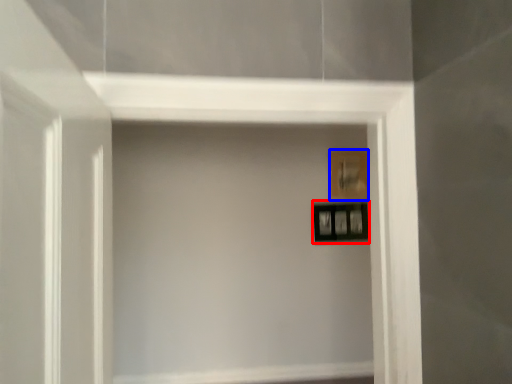
Question: Among these objects, which one is farthest to the camera, picture frame (highlighted by a red box) or picture frame (highlighted by a blue box)?

Choices:
 (A) picture frame
 (B) picture frame

Answer: (B)